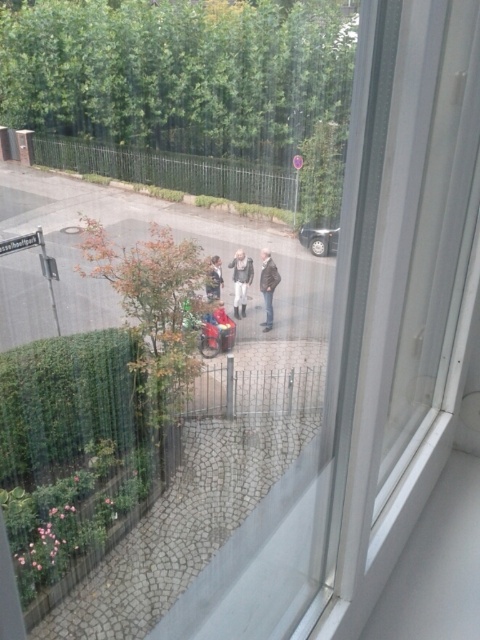
You are standing inside the building looking through the window. You see a silver metallic car at center and a dark gray jacket at center. Which object appears narrower when viewed from your current position?

The silver metallic car at center is thinner than the dark gray jacket at center, so the silver metallic car at center appears narrower when viewed from your current position.